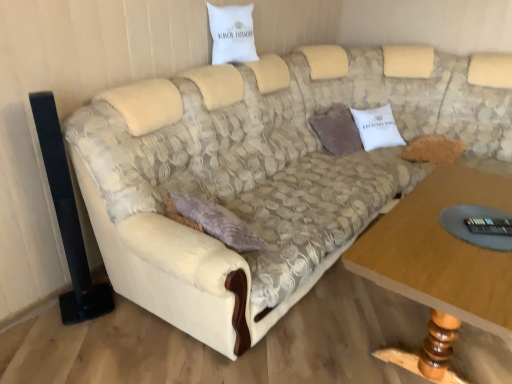
Question: Considering the positions of fuzzy brown pillow at right, the second pillow viewed from the top, and wooden table at lower right in the image, is fuzzy brown pillow at right, the second pillow viewed from the top, wider or thinner than wooden table at lower right?

Choices:
 (A) wide
 (B) thin

Answer: (B)

Question: From the image's perspective, is fuzzy brown pillow at right, the 2th pillow in the front-to-back sequence, above or below wooden table at lower right?

Choices:
 (A) below
 (B) above

Answer: (B)

Question: Which is nearer to the fuzzy brown pillow at right, the 2th pillow in the left-to-right sequence?

Choices:
 (A) beige fabric couch at center
 (B) transparent glass remote control at lower right
 (C) white fabric pillow at upper center, the second pillow when ordered from back to front
 (D) wooden table at lower right

Answer: (A)

Question: Which object is the closest to the wooden table at lower right?

Choices:
 (A) transparent glass remote control at lower right
 (B) white fabric pillow at upper center, the second pillow from the right
 (C) fuzzy brown pillow at right, the 2th pillow in the left-to-right sequence
 (D) beige fabric couch at center

Answer: (A)